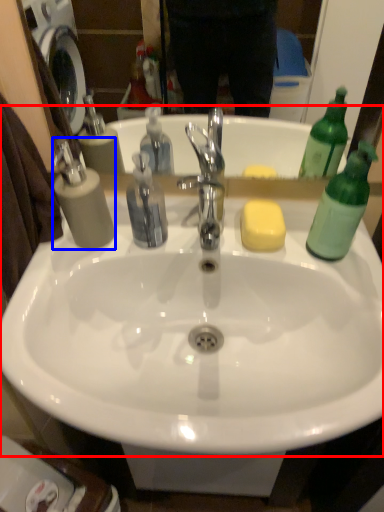
Question: Among these objects, which one is farthest to the camera, sink (highlighted by a red box) or soap dispenser (highlighted by a blue box)?

Choices:
 (A) sink
 (B) soap dispenser

Answer: (B)